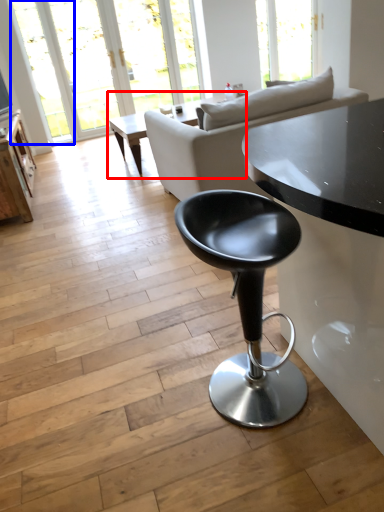
Question: Among these objects, which one is nearest to the camera, coffee table (highlighted by a red box) or window (highlighted by a blue box)?

Choices:
 (A) coffee table
 (B) window

Answer: (A)